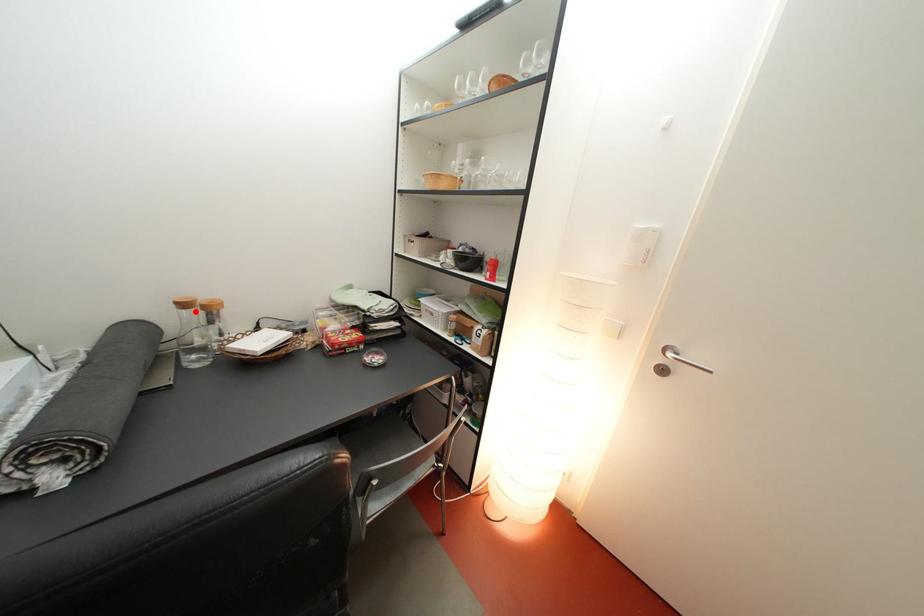
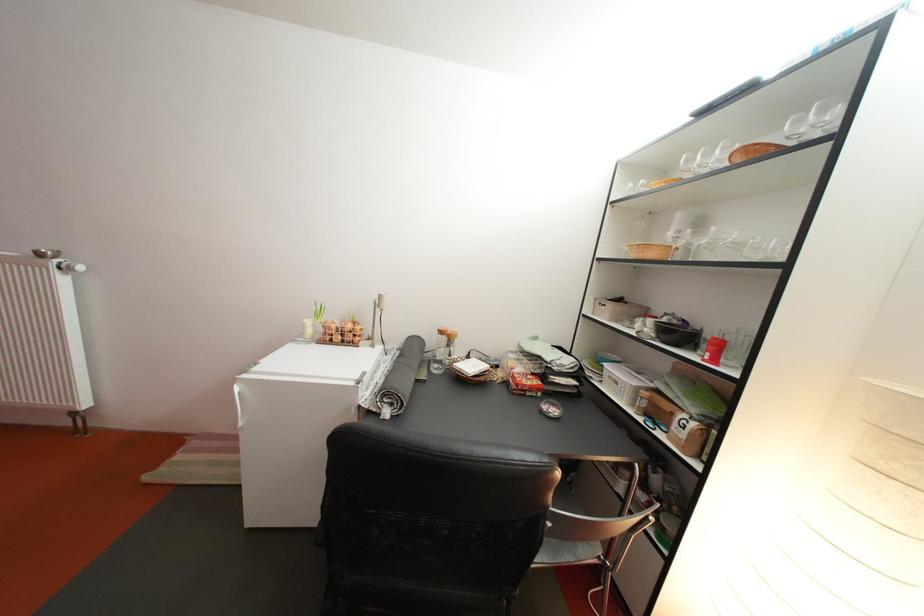
Locate, in the second image, the point that corresponds to the highlighted location in the first image.

(453, 339)